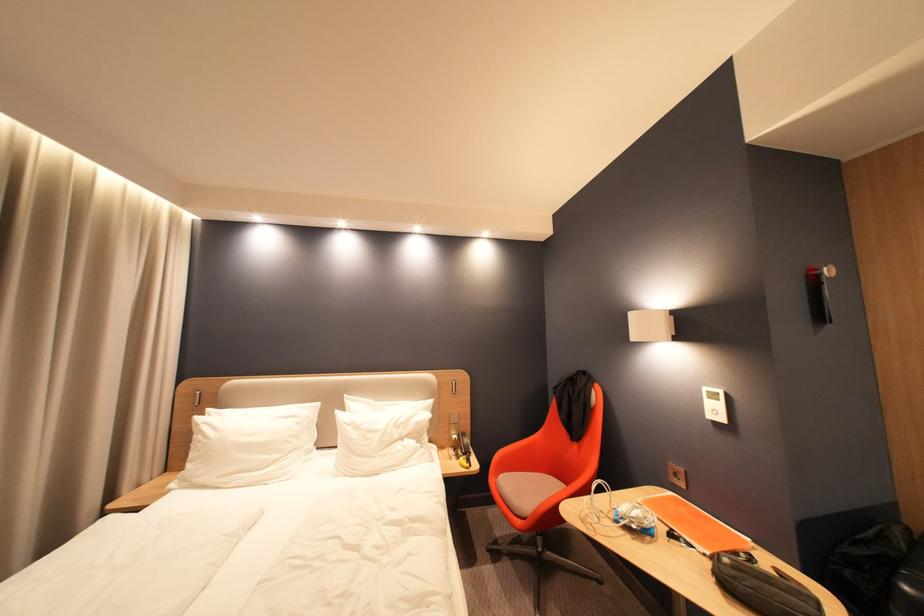
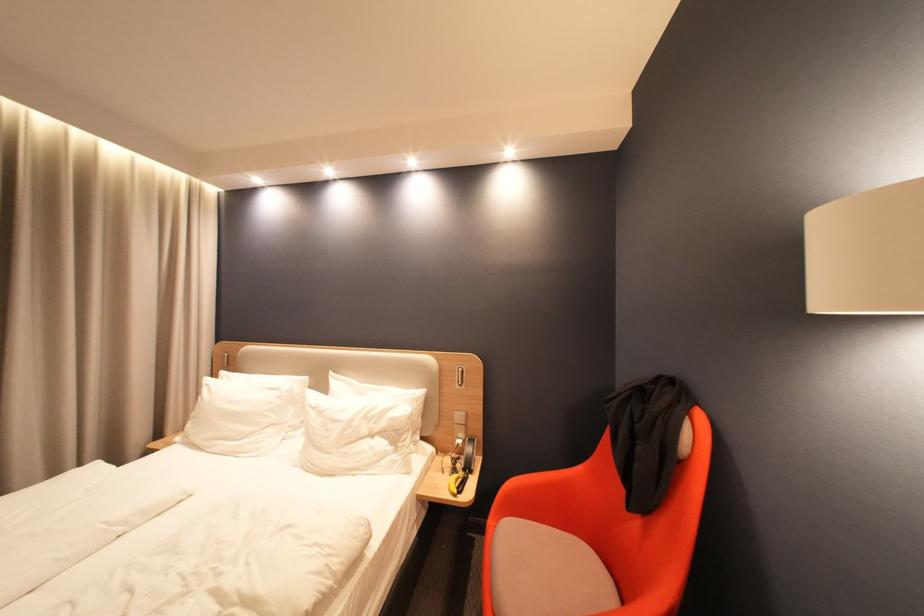
Question: The camera is either moving clockwise (left) or counter-clockwise (right) around the object. The first image is from the beginning of the video and the second image is from the end. Is the camera moving left or right when shooting the video?

Choices:
 (A) Left
 (B) Right

Answer: (B)